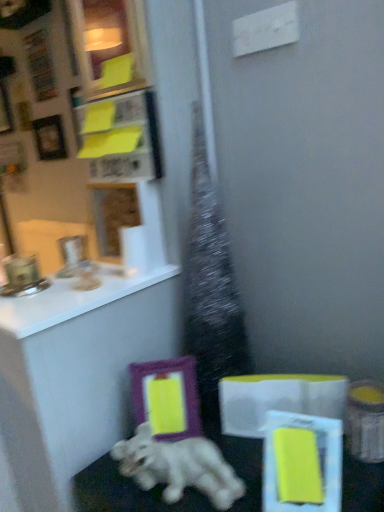
Locate an element on the screen. Image resolution: width=384 pixels, height=512 pixels. white glossy countertop at upper left is located at coordinates (71, 300).

Find the location of a particular element. Image resolution: width=384 pixels, height=512 pixels. white glossy dog at lower center is located at coordinates (178, 467).

I want to click on purple matte picture frame at lower center, marked as the first picture frame in a right-to-left arrangement, so click(167, 397).

In order to face wooden photo frame at upper left, the 3th picture frame when ordered from top to bottom, should I rotate leftwards or rightwards?

A 18.871 degree turn to the left will do.

The height and width of the screenshot is (512, 384). In order to click on wooden photo frame at upper left, the 3th picture frame when ordered from top to bottom in this screenshot , I will do [50, 138].

What do you see at coordinates (110, 45) in the screenshot? The height and width of the screenshot is (512, 384). I see `matte yellow picture frame at upper left, the 4th picture frame in the back-to-front sequence` at bounding box center [110, 45].

Locate an element on the screen. The height and width of the screenshot is (512, 384). yellow paper at upper left is located at coordinates (122, 138).

Considering the relative sizes of wooden photo frame at upper left, which ranks as the 2th picture frame in bottom-to-top order, and white glossy elephant at lower center in the image provided, is wooden photo frame at upper left, which ranks as the 2th picture frame in bottom-to-top order, smaller than white glossy elephant at lower center?

Yes.

How different are the orientations of wooden photo frame at upper left, arranged as the 2th picture frame when viewed from the left, and white glossy elephant at lower center in degrees?

A: wooden photo frame at upper left, arranged as the 2th picture frame when viewed from the left, and white glossy elephant at lower center are facing 0.133 degrees away from each other.

Is point (62, 130) farther from viewer compared to point (83, 492)?

Yes, point (62, 130) is behind point (83, 492).

Visually, is wooden photo frame at upper left, which ranks as the 3th picture frame in right-to-left order, positioned to the left or to the right of white glossy elephant at lower center?

wooden photo frame at upper left, which ranks as the 3th picture frame in right-to-left order, is to the left of white glossy elephant at lower center.

This screenshot has width=384, height=512. I want to click on picture frame that is the 1st object located behind the white glossy dog at lower center, so click(110, 45).

From the image's perspective, is matte yellow picture frame at upper left, the 4th picture frame in the back-to-front sequence, positioned above or below white glossy dog at lower center?

Clearly, from the image's perspective, matte yellow picture frame at upper left, the 4th picture frame in the back-to-front sequence, is above white glossy dog at lower center.

Is matte yellow picture frame at upper left, the third picture frame positioned from the bottom, oriented towards white glossy dog at lower center?

No, matte yellow picture frame at upper left, the third picture frame positioned from the bottom, does not turn towards white glossy dog at lower center.

Is purple matte picture frame at lower center, the 4th picture frame from the top, positioned behind matte yellow picture frame at upper left, which is the 3th picture frame from left to right?

That is True.

From the image's perspective, count 2nd picture frames upward from the purple matte picture frame at lower center, the 4th picture frame from the top, and point to it. Please provide its 2D coordinates.

[(110, 45)]

Considering the relative positions of purple matte picture frame at lower center, the third picture frame positioned from the back, and matte yellow picture frame at upper left, the 4th picture frame in the back-to-front sequence, in the image provided, is purple matte picture frame at lower center, the third picture frame positioned from the back, to the right of matte yellow picture frame at upper left, the 4th picture frame in the back-to-front sequence, from the viewer's perspective?

Yes.

Locate an element on the screen. The height and width of the screenshot is (512, 384). the 1st picture frame in front of the yellow paper at upper left is located at coordinates (167, 397).

How different are the orientations of purple matte picture frame at lower center, which is the fourth picture frame from left to right, and yellow paper at upper left in degrees?

There is a 49.7-degree angle between the facing directions of purple matte picture frame at lower center, which is the fourth picture frame from left to right, and yellow paper at upper left.

Is point (144, 405) positioned before point (118, 126)?

Yes, point (144, 405) is in front of point (118, 126).

Which of these two, wooden photo frame at upper left, which ranks as the 3th picture frame in right-to-left order, or matte purple picture frame at upper left, which is the fourth picture frame in right-to-left order, is thinner?

wooden photo frame at upper left, which ranks as the 3th picture frame in right-to-left order, is thinner.

Does wooden photo frame at upper left, which ranks as the 3th picture frame in right-to-left order, have a greater height compared to matte purple picture frame at upper left, which appears as the 4th picture frame when ordered from the bottom?

No, wooden photo frame at upper left, which ranks as the 3th picture frame in right-to-left order, is not taller than matte purple picture frame at upper left, which appears as the 4th picture frame when ordered from the bottom.

Are wooden photo frame at upper left, marked as the third picture frame in a front-to-back arrangement, and matte purple picture frame at upper left, which is the first picture frame from left to right, making contact?

They are not placed beside each other.

Considering the positions of points (49, 155) and (7, 125), is point (49, 155) farther from camera compared to point (7, 125)?

No, it is not.

Considering the positions of point (160, 437) and point (55, 147), is point (160, 437) closer or farther from the camera than point (55, 147)?

Point (160, 437) is positioned closer to the camera compared to point (55, 147).

Does purple matte picture frame at lower center, marked as the first picture frame in a right-to-left arrangement, touch wooden photo frame at upper left, which ranks as the 2th picture frame in bottom-to-top order?

purple matte picture frame at lower center, marked as the first picture frame in a right-to-left arrangement, and wooden photo frame at upper left, which ranks as the 2th picture frame in bottom-to-top order, are not in contact.

From the image's perspective, which one is positioned higher, purple matte picture frame at lower center, the third picture frame positioned from the back, or wooden photo frame at upper left, which ranks as the 3th picture frame in right-to-left order?

wooden photo frame at upper left, which ranks as the 3th picture frame in right-to-left order, from the image's perspective.

Is wooden photo frame at upper left, the 2th picture frame in the back-to-front sequence, at the back of purple matte picture frame at lower center, which is the fourth picture frame from left to right?

purple matte picture frame at lower center, which is the fourth picture frame from left to right, does not have its back to wooden photo frame at upper left, the 2th picture frame in the back-to-front sequence.

Does white glossy elephant at lower center have a lesser height compared to matte purple picture frame at upper left, which appears as the 4th picture frame when ordered from the bottom?

Incorrect, the height of white glossy elephant at lower center does not fall short of that of matte purple picture frame at upper left, which appears as the 4th picture frame when ordered from the bottom.

Identify the location of the 4th picture frame behind the white glossy elephant at lower center, starting your count from the anchor. This screenshot has width=384, height=512. (5, 111).

Consider the image. From a real-world perspective, is white glossy elephant at lower center beneath matte purple picture frame at upper left, the first picture frame when ordered from top to bottom?

Yes, from a real-world perspective, white glossy elephant at lower center is below matte purple picture frame at upper left, the first picture frame when ordered from top to bottom.

Find the location of a particular element. The width and height of the screenshot is (384, 512). table located underneath the wooden photo frame at upper left, which ranks as the 2th picture frame in bottom-to-top order (from a real-world perspective) is located at coordinates (127, 493).

Identify the location of dog that appears in front of the matte yellow picture frame at upper left, which is the 3th picture frame from left to right. (178, 467).

From the image, which object appears to be farther from matte yellow picture frame at upper left, the 4th picture frame in the back-to-front sequence, yellow paper at upper left or matte purple picture frame at upper left, which appears as the 4th picture frame when ordered from the bottom?

The object further to matte yellow picture frame at upper left, the 4th picture frame in the back-to-front sequence, is matte purple picture frame at upper left, which appears as the 4th picture frame when ordered from the bottom.

Based on their spatial positions, is purple matte picture frame at lower center, which is the fourth picture frame from left to right, or white glossy dog at lower center further from yellow paper at upper left?

The object further to yellow paper at upper left is white glossy dog at lower center.

From the image, which object appears to be nearer to white glossy elephant at lower center, wooden photo frame at upper left, the 2th picture frame in the back-to-front sequence, or white glossy dog at lower center?

The object closer to white glossy elephant at lower center is white glossy dog at lower center.

From the image, which object appears to be farther from matte purple picture frame at upper left, which appears as the 4th picture frame when ordered from the bottom, white glossy elephant at lower center or purple matte picture frame at lower center, the 2th picture frame from the front?

white glossy elephant at lower center is positioned further to the anchor matte purple picture frame at upper left, which appears as the 4th picture frame when ordered from the bottom.

In the scene shown: Which object lies further to the anchor point matte yellow picture frame at upper left, which is the 3th picture frame from left to right, white glossy dog at lower center or white glossy elephant at lower center?

white glossy elephant at lower center is positioned further to the anchor matte yellow picture frame at upper left, which is the 3th picture frame from left to right.

Considering their positions, is white glossy elephant at lower center positioned further to matte yellow picture frame at upper left, which is the 3th picture frame from left to right, than matte purple picture frame at upper left, which ranks as the first picture frame in back-to-front order?

matte purple picture frame at upper left, which ranks as the first picture frame in back-to-front order, lies further to matte yellow picture frame at upper left, which is the 3th picture frame from left to right, than the other object.

From the image, which object appears to be farther from yellow paper at upper left, white glossy dog at lower center or white glossy elephant at lower center?

The object further to yellow paper at upper left is white glossy elephant at lower center.

From the image, which object appears to be nearer to matte purple picture frame at upper left, which ranks as the first picture frame in back-to-front order, white glossy dog at lower center or white glossy elephant at lower center?

white glossy dog at lower center lies closer to matte purple picture frame at upper left, which ranks as the first picture frame in back-to-front order, than the other object.

At what (x,y) coordinates should I click in order to perform the action: click on dog positioned between white glossy elephant at lower center and matte purple picture frame at upper left, which is the first picture frame from left to right, from near to far. Please return your answer as a coordinate pair (x, y). Looking at the image, I should click on (178, 467).

The image size is (384, 512). In order to click on picture frame that lies between yellow paper at upper left and white glossy elephant at lower center from top to bottom in this screenshot , I will do `click(167, 397)`.

The image size is (384, 512). What are the coordinates of `picture frame located between yellow paper at upper left and matte purple picture frame at upper left, which is the fourth picture frame in right-to-left order, in the depth direction` in the screenshot? It's located at (50, 138).

You are a GUI agent. You are given a task and a screenshot of the screen. Output one action in this format:
    pyautogui.click(x=<x>, y=<y>)
    Task: Click on the picture frame between matte yellow picture frame at upper left, the 4th picture frame in the back-to-front sequence, and wooden photo frame at upper left, the 3th picture frame when ordered from top to bottom, along the z-axis
    The width and height of the screenshot is (384, 512).
    Given the screenshot: What is the action you would take?
    pyautogui.click(x=167, y=397)